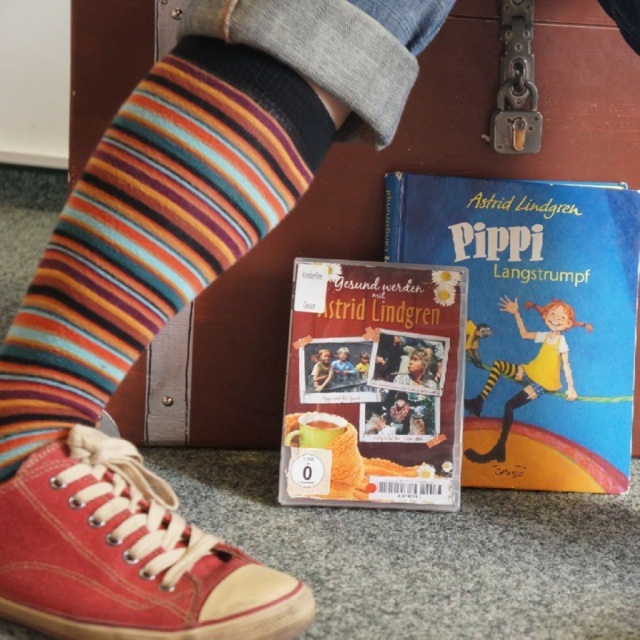
Is multicolored knitted sock at lower left wider than matte yellow socks at lower left?

Correct, the width of multicolored knitted sock at lower left exceeds that of matte yellow socks at lower left.

Which is above, multicolored knitted sock at lower left or matte yellow socks at lower left?

Positioned higher is multicolored knitted sock at lower left.

Is point (188, 166) farther from viewer compared to point (484, 337)?

No, it is in front of (484, 337).

You are a GUI agent. You are given a task and a screenshot of the screen. Output one action in this format:
    pyautogui.click(x=<x>, y=<y>)
    Task: Click on the multicolored knitted sock at lower left
    This screenshot has width=640, height=640.
    Given the screenshot: What is the action you would take?
    [x=154, y=227]

Does canvas shoe at lower left have a lesser height compared to matte yellow socks at lower left?

Incorrect, canvas shoe at lower left's height does not fall short of matte yellow socks at lower left's.

Is canvas shoe at lower left to the right of matte yellow socks at lower left from the viewer's perspective?

Incorrect, canvas shoe at lower left is not on the right side of matte yellow socks at lower left.

Find the location of `canvas shoe at lower left`. canvas shoe at lower left is located at coordinates (125, 556).

Describe the element at coordinates (125, 556) in the screenshot. I see `canvas shoe at lower left` at that location.

At what (x,y) coordinates should I click in order to perform the action: click on canvas shoe at lower left. Please return your answer as a coordinate pair (x, y). The height and width of the screenshot is (640, 640). Looking at the image, I should click on (125, 556).